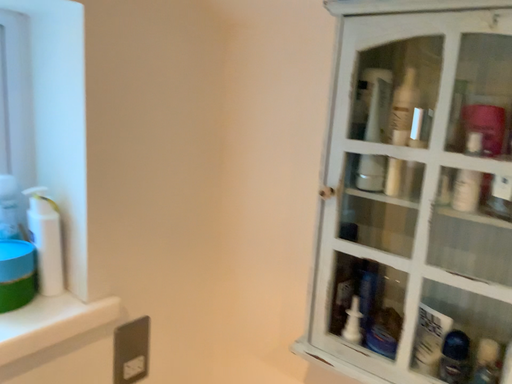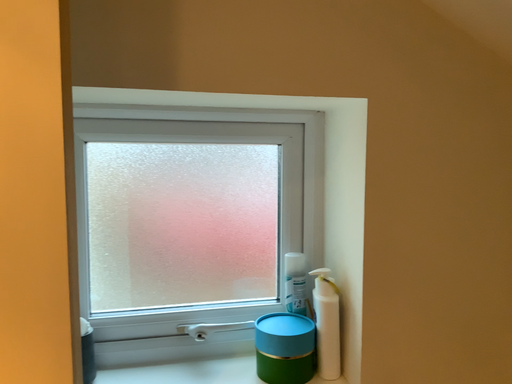
Question: How did the camera likely rotate when shooting the video?

Choices:
 (A) rotated right
 (B) rotated left

Answer: (B)